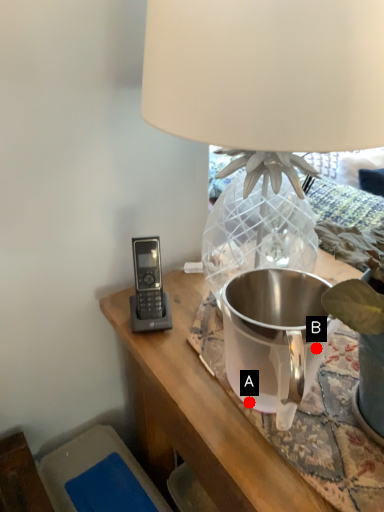
Question: Two points are circled on the image, labeled by A and B beside each circle. Which point is closer to the camera taking this photo?

Choices:
 (A) A is closer
 (B) B is closer

Answer: (A)